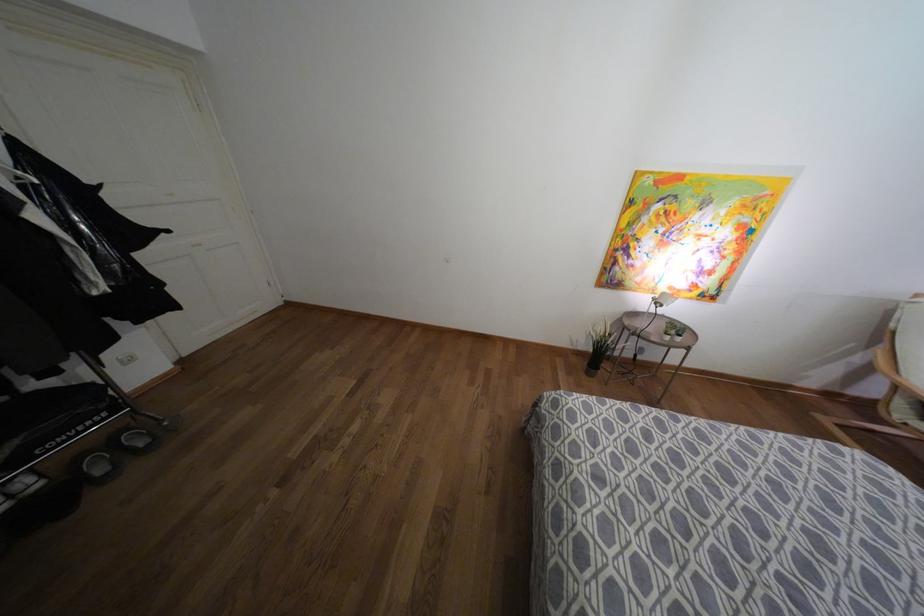
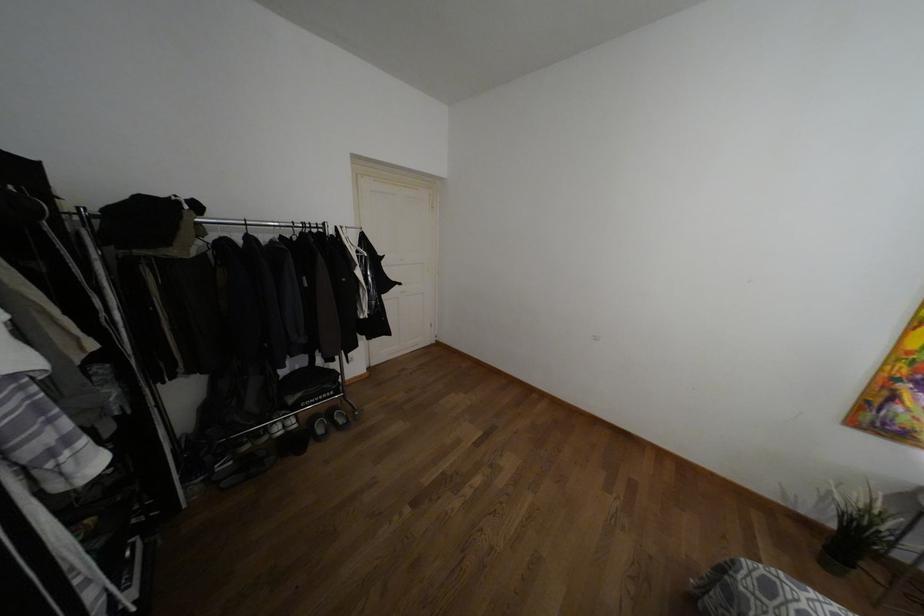
Find the pixel in the second image that matches the point at 554,403 in the first image.

(769, 588)